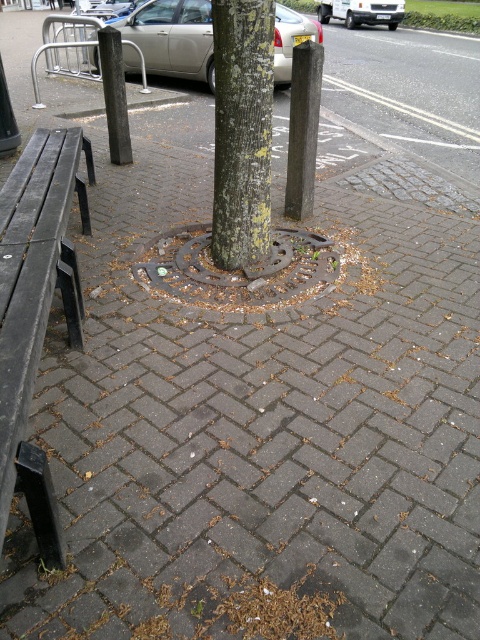
Does dark gray textured pole at left have a greater height compared to silver metallic van at upper center?

Yes.

Can you confirm if dark gray textured pole at left is positioned to the right of silver metallic van at upper center?

No, dark gray textured pole at left is not to the right of silver metallic van at upper center.

Which is behind, point (106, 74) or point (364, 3)?

Positioned behind is point (364, 3).

Where is `dark gray textured pole at left`? This screenshot has height=640, width=480. dark gray textured pole at left is located at coordinates (115, 93).

Between point (316, 129) and point (371, 13), which one is positioned behind?

The point (371, 13) is more distant.

Does dark gray stone post at center have a smaller size compared to silver metallic van at upper center?

Correct, dark gray stone post at center occupies less space than silver metallic van at upper center.

Does point (302, 45) come in front of point (324, 0)?

Yes, point (302, 45) is closer to viewer.

Locate an element on the screen. The width and height of the screenshot is (480, 640). dark gray stone post at center is located at coordinates (302, 129).

Describe the element at coordinates (241, 131) in the screenshot. I see `smooth bark tree at center` at that location.

Based on the photo, who is higher up, smooth bark tree at center or dark gray textured pole at left?

dark gray textured pole at left is above.

Looking at this image, who is more forward, (252, 186) or (130, 145)?

Positioned in front is point (252, 186).

Locate an element on the screen. The height and width of the screenshot is (640, 480). smooth bark tree at center is located at coordinates (241, 131).